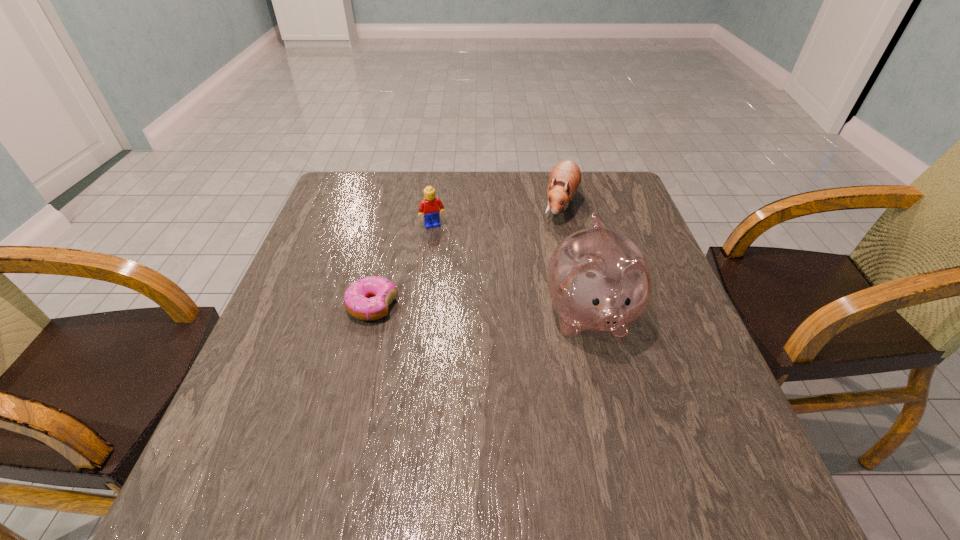
Where is `vacant space at the far left corner of the desktop`? This screenshot has height=540, width=960. vacant space at the far left corner of the desktop is located at coordinates (343, 193).

Where is `free point at the far right corner`? free point at the far right corner is located at coordinates (637, 205).

The width and height of the screenshot is (960, 540). I want to click on vacant point located between the leftmost object and the Lego, so tap(403, 266).

The width and height of the screenshot is (960, 540). Find the location of `vacant point located between the doughnut and the piggy bank`. vacant point located between the doughnut and the piggy bank is located at coordinates (481, 310).

Find the location of a particular element. free space between the hamster and the leftmost object is located at coordinates (467, 255).

Locate an element on the screen. This screenshot has height=540, width=960. unoccupied position between the second object from left to right and the tallest object is located at coordinates [x=512, y=271].

Identify the location of free space that is in between the leftmost object and the second object from left to right. (403, 266).

This screenshot has width=960, height=540. Identify the location of free point between the tallest object and the shortest object. (481, 310).

This screenshot has width=960, height=540. I want to click on empty space between the hamster and the doughnut, so click(x=467, y=255).

At what (x,y) coordinates should I click in order to perform the action: click on free point between the hamster and the doughnut. Please return your answer as a coordinate pair (x, y). This screenshot has width=960, height=540. Looking at the image, I should click on (467, 255).